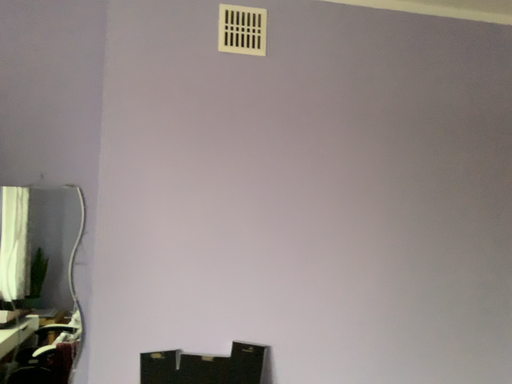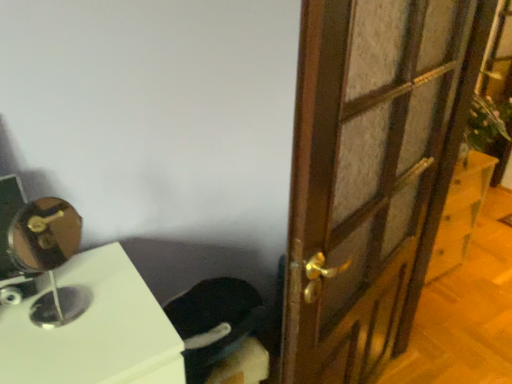
Question: How did the camera likely rotate when shooting the video?

Choices:
 (A) rotated left
 (B) rotated right

Answer: (B)